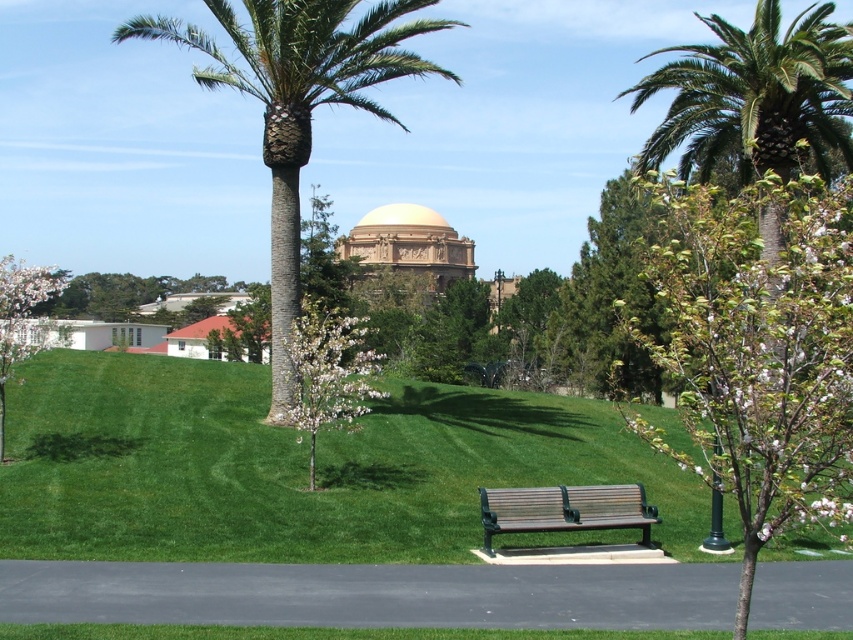
You are planning to plant a new tree in the park. The green leafy tree at center requires a space of 3 meters in diameter, while the white blossoming tree at lower left needs 4 meters. Based on their sizes, will both trees fit in their current locations without overcrowding each other?

The green leafy tree at center is smaller than the white blossoming tree at lower left. Since the green leafy tree requires 3 meters and the white blossoming tree needs 4 meters, both can fit in their current locations as long as they have sufficient space allocated according to their size requirements.

You are a park visitor who wants to take a photo of the green textured palm tree at center without the green leafy tree at center blocking the view. Is it possible to do so from your current position?

The green leafy tree at center is in front of the green textured palm tree at center, so you cannot take a photo of the green textured palm tree at center without the green leafy tree at center blocking the view from your current position.